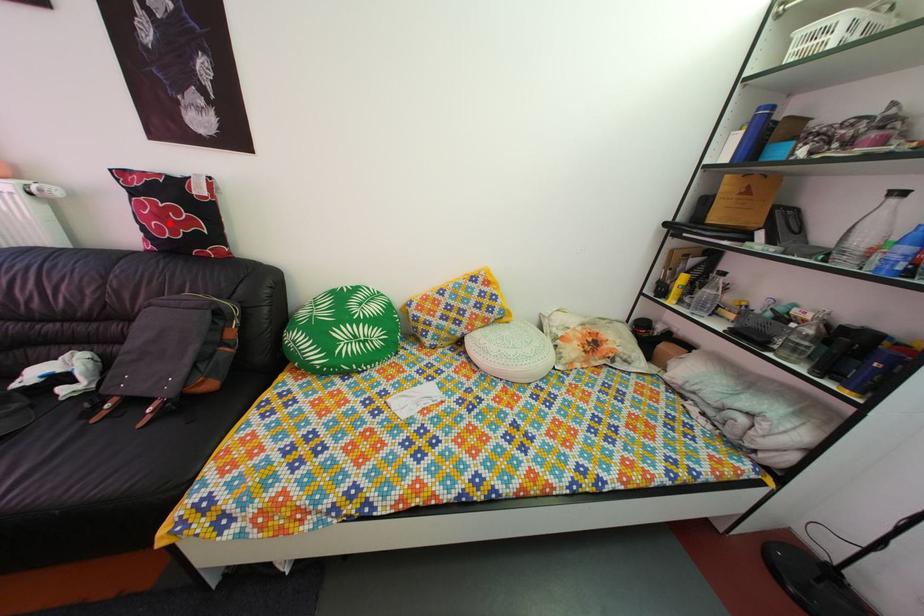
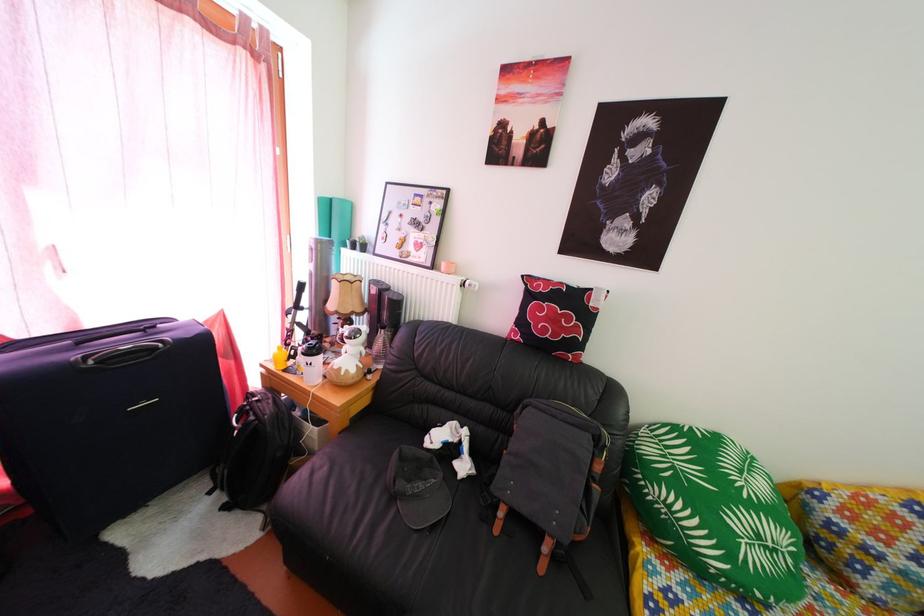
Find the pixel in the second image that matches the highlighted location in the first image.

(562, 328)